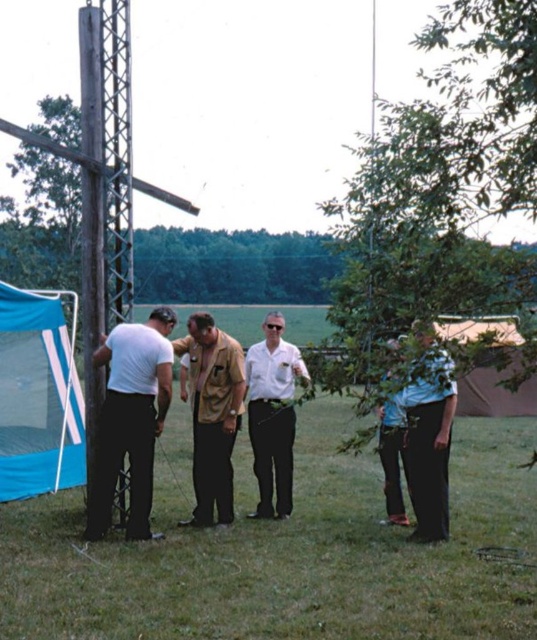
Does blue fabric tent at lower left appear on the left side of white glossy shirt at center?

Yes, blue fabric tent at lower left is to the left of white glossy shirt at center.

Is blue fabric tent at lower left to the right of white glossy shirt at center from the viewer's perspective?

Incorrect, blue fabric tent at lower left is not on the right side of white glossy shirt at center.

Identify the location of blue fabric tent at lower left. (39, 396).

Locate an element on the screen. blue fabric tent at lower left is located at coordinates (39, 396).

Who is more forward, (x=105, y=44) or (x=14, y=314)?

Positioned in front is point (x=105, y=44).

Which of these two, brown wooden pole at left or blue fabric tent at lower left, stands taller?

brown wooden pole at left is taller.

Is point (191, 205) more distant than point (18, 397)?

No, it is in front of (18, 397).

Find the location of a particular element. This screenshot has height=640, width=537. brown wooden pole at left is located at coordinates (105, 195).

Can you confirm if white matte shirt at left is smaller than white glossy shirt at center?

Yes.

Between point (143, 364) and point (265, 516), which one is positioned in front?

Point (143, 364)

Where is `white matte shirt at left`? The image size is (537, 640). white matte shirt at left is located at coordinates (132, 419).